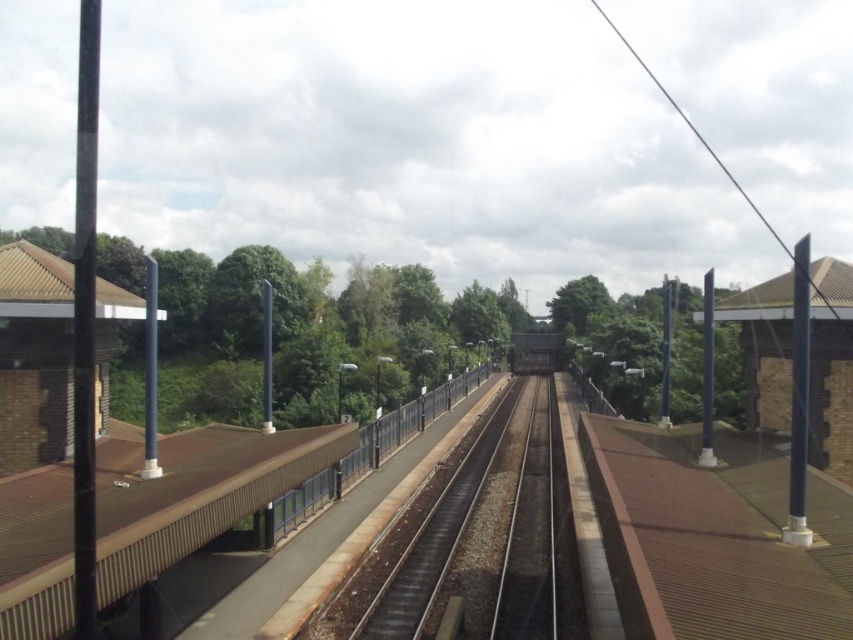
Question: Does black asphalt track at center appear over brown concrete rail at center?

Choices:
 (A) no
 (B) yes

Answer: (A)

Question: Where is black asphalt track at center located in relation to brown concrete rail at center in the image?

Choices:
 (A) below
 (B) above

Answer: (A)

Question: Observing the image, what is the correct spatial positioning of black asphalt track at center in reference to brown concrete rail at center?

Choices:
 (A) right
 (B) left

Answer: (A)

Question: Which point is farther to the camera?

Choices:
 (A) (403, 621)
 (B) (364, 452)

Answer: (B)

Question: Which point appears farthest from the camera in this image?

Choices:
 (A) (469, 529)
 (B) (267, 531)

Answer: (A)